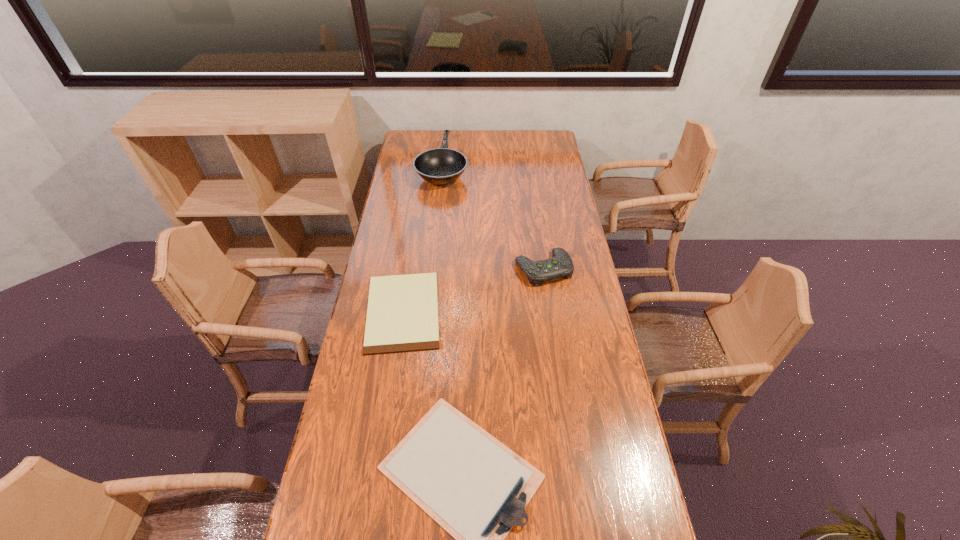
Locate an element on the screen. This screenshot has height=540, width=960. the farthest object is located at coordinates (440, 166).

The image size is (960, 540). Find the location of `frying pan`. frying pan is located at coordinates (440, 166).

Locate an element on the screen. The width and height of the screenshot is (960, 540). control is located at coordinates (561, 265).

This screenshot has width=960, height=540. What are the coordinates of `the farther clipboard` in the screenshot? It's located at (402, 316).

Identify the location of the shorter clipboard. This screenshot has height=540, width=960. (402, 316).

Locate an element on the screen. vacant area situated on the left of the farthest object is located at coordinates (405, 168).

This screenshot has height=540, width=960. I want to click on vacant space located 0.270m on the back of the control, so click(x=535, y=211).

The width and height of the screenshot is (960, 540). What are the coordinates of `vacant space located 0.170m on the back of the shortest object` in the screenshot? It's located at (413, 245).

Find the location of `object at the far edge`. object at the far edge is located at coordinates (440, 166).

The height and width of the screenshot is (540, 960). I want to click on frying pan located in the left edge section of the desktop, so pyautogui.click(x=440, y=166).